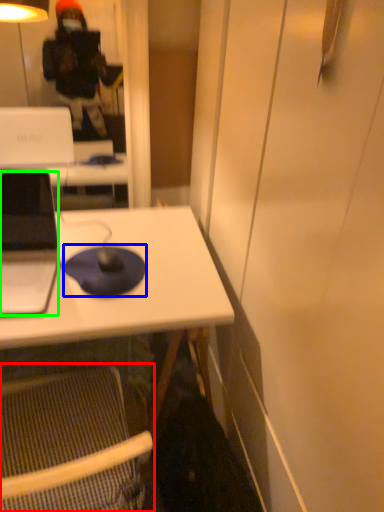
Question: Based on their relative distances, which object is farther from folding chair (highlighted by a red box)? Choose from mousepad (highlighted by a blue box) and laptop (highlighted by a green box).

Choices:
 (A) mousepad
 (B) laptop

Answer: (B)